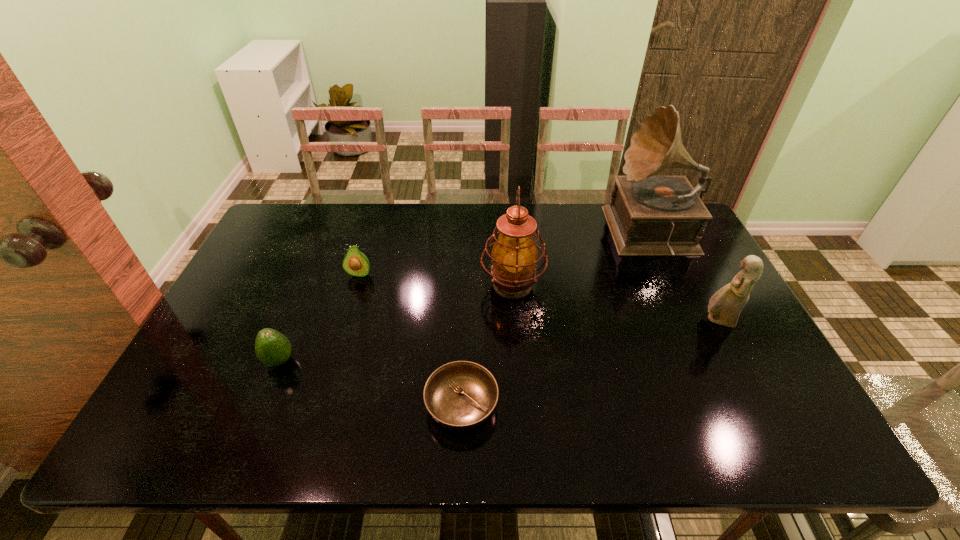
This screenshot has width=960, height=540. I want to click on empty space that is in between the farther avocado and the soup bowl, so click(411, 340).

At what (x,y) coordinates should I click in order to perform the action: click on free point between the record player and the oil lamp. Please return your answer as a coordinate pair (x, y). Looking at the image, I should click on (583, 260).

Where is `vacant area that lies between the fourth shortest object and the leftmost object`? The width and height of the screenshot is (960, 540). vacant area that lies between the fourth shortest object and the leftmost object is located at coordinates (498, 341).

You are a GUI agent. You are given a task and a screenshot of the screen. Output one action in this format:
    pyautogui.click(x=<x>, y=<y>)
    Task: Click on the empty space between the record player and the soup bowl
    The height and width of the screenshot is (540, 960).
    Given the screenshot: What is the action you would take?
    pyautogui.click(x=558, y=320)

Find the location of a particular element. This screenshot has width=960, height=540. free spot between the fourth farthest object and the tallest object is located at coordinates (685, 278).

Where is `vacant space that's between the leftmost object and the nearest object`? The image size is (960, 540). vacant space that's between the leftmost object and the nearest object is located at coordinates (371, 383).

Locate an element on the screen. The image size is (960, 540). vacant space in between the shortest object and the third tallest object is located at coordinates (589, 363).

Locate an element on the screen. The height and width of the screenshot is (540, 960). vacant region between the fourth shortest object and the soup bowl is located at coordinates (589, 363).

Identify the location of object that is the fourth closest to the fifth object from right to left. (648, 215).

Identify the location of the third closest object to the record player. The width and height of the screenshot is (960, 540). (461, 395).